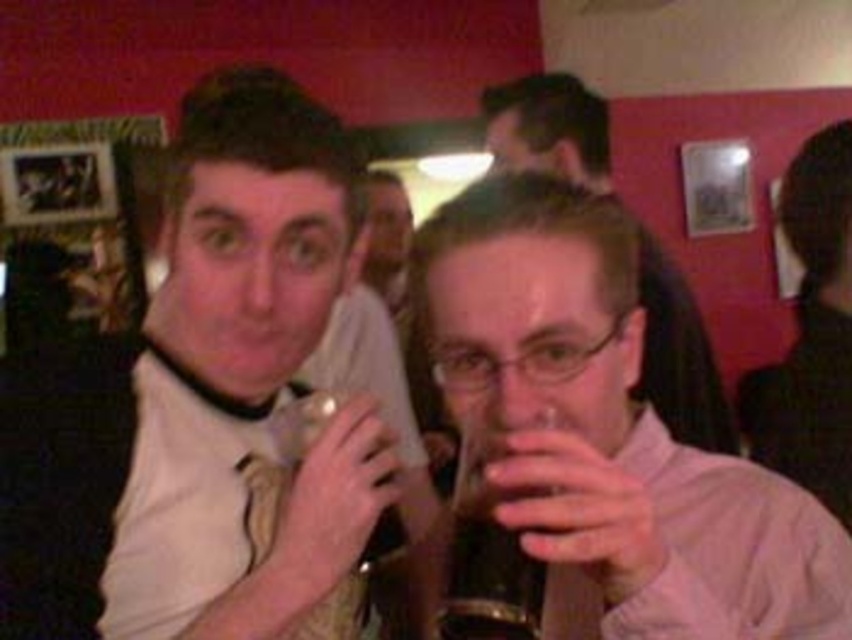
You are standing in the bar scene and need to locate the smooth black hair at upper right. According to the coordinates provided, where exactly is it positioned?

The smooth black hair at upper right is precisely located at coordinates point (810, 332).